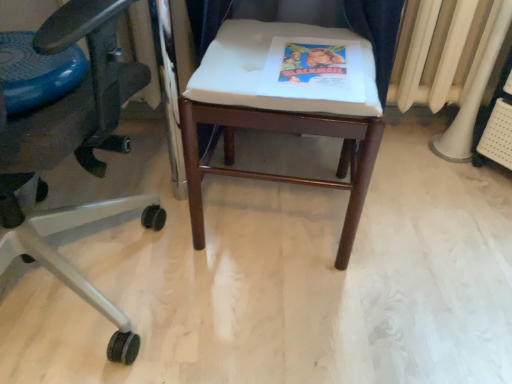
Question: From a real-world perspective, is blue rubber ball at left positioned over white plastic radiator at right based on gravity?

Choices:
 (A) no
 (B) yes

Answer: (B)

Question: Could you tell me if blue rubber ball at left is facing white plastic radiator at right?

Choices:
 (A) yes
 (B) no

Answer: (B)

Question: Can you confirm if blue rubber ball at left is thinner than white plastic radiator at right?

Choices:
 (A) yes
 (B) no

Answer: (B)

Question: From the image's perspective, is blue rubber ball at left beneath white plastic radiator at right?

Choices:
 (A) yes
 (B) no

Answer: (A)

Question: Is blue rubber ball at left wider than white plastic radiator at right?

Choices:
 (A) yes
 (B) no

Answer: (A)

Question: Would you say matte paper book at center is inside or outside white fabric stool at center?

Choices:
 (A) inside
 (B) outside

Answer: (A)

Question: Considering their positions, is matte paper book at center located in front of or behind white fabric stool at center?

Choices:
 (A) front
 (B) behind

Answer: (B)

Question: Is matte paper book at center bigger or smaller than white fabric stool at center?

Choices:
 (A) small
 (B) big

Answer: (A)

Question: From the image's perspective, relative to white fabric stool at center, is matte paper book at center above or below?

Choices:
 (A) above
 (B) below

Answer: (A)

Question: In the image, is white fabric stool at center positioned in front of or behind matte paper book at center?

Choices:
 (A) behind
 (B) front

Answer: (B)

Question: In terms of size, does white fabric stool at center appear bigger or smaller than matte paper book at center?

Choices:
 (A) small
 (B) big

Answer: (B)

Question: Considering the positions of point (369, 178) and point (350, 79), is point (369, 178) closer or farther from the camera than point (350, 79)?

Choices:
 (A) closer
 (B) farther

Answer: (B)

Question: In terms of width, does white fabric stool at center look wider or thinner when compared to matte paper book at center?

Choices:
 (A) wide
 (B) thin

Answer: (A)

Question: Is white fabric stool at center situated inside matte black office chair at left or outside?

Choices:
 (A) inside
 (B) outside

Answer: (B)

Question: Is white fabric stool at center taller or shorter than matte black office chair at left?

Choices:
 (A) tall
 (B) short

Answer: (B)